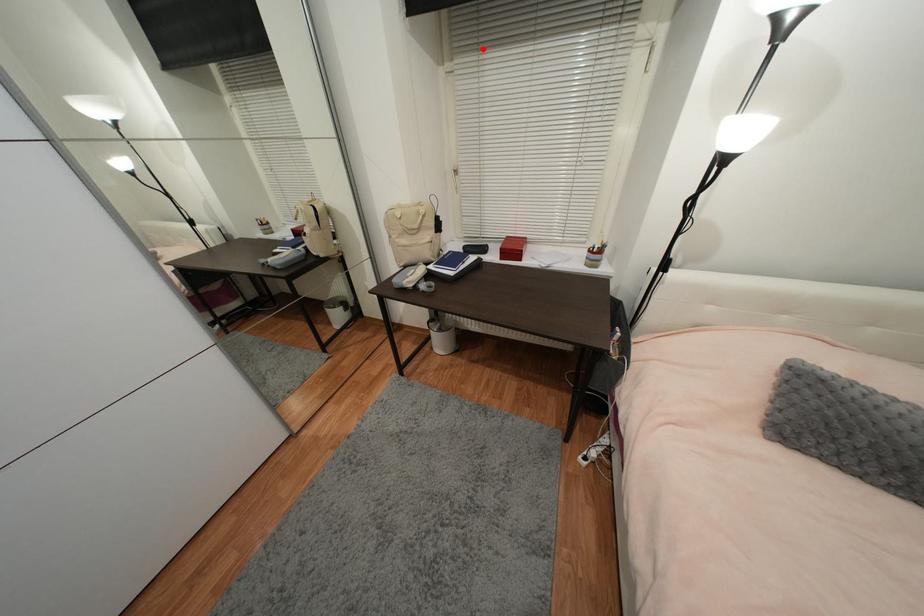
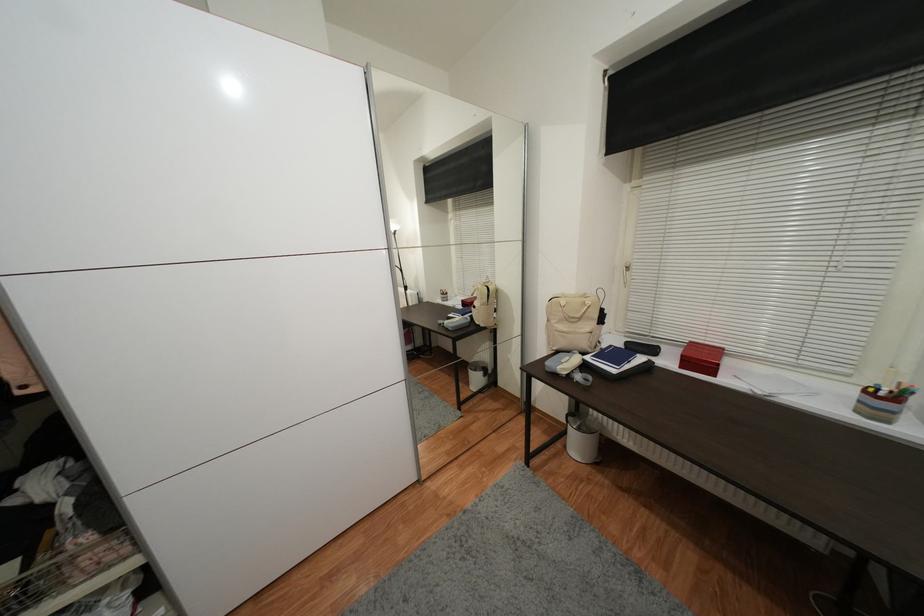
Find the pixel in the second image that matches the highlighted location in the first image.

(678, 167)